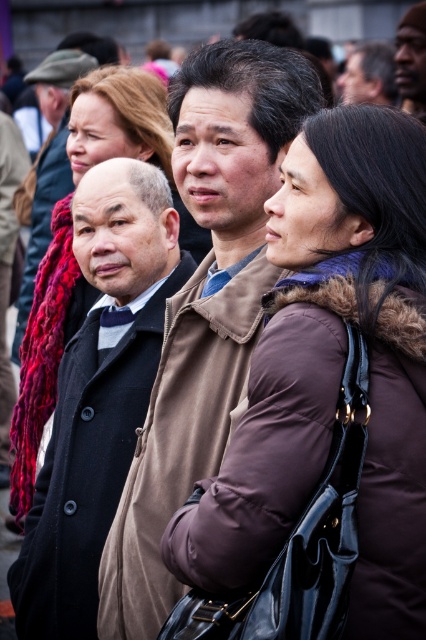
Does dark brown wool coat at center appear over knitted wool scarf at upper left?

No, dark brown wool coat at center is not above knitted wool scarf at upper left.

Describe the element at coordinates (98, 394) in the screenshot. I see `dark brown wool coat at center` at that location.

Measure the distance between dark brown wool coat at center and camera.

dark brown wool coat at center and camera are 52.27 meters apart from each other.

Where is `dark brown wool coat at center`? The image size is (426, 640). dark brown wool coat at center is located at coordinates (98, 394).

What do you see at coordinates (331, 380) in the screenshot?
I see `brown fuzzy coat at center` at bounding box center [331, 380].

Between brown fuzzy coat at center and knitted wool scarf at upper left, which one appears on the right side from the viewer's perspective?

From the viewer's perspective, brown fuzzy coat at center appears more on the right side.

Is point (354, 576) less distant than point (31, 72)?

That is True.

The height and width of the screenshot is (640, 426). I want to click on brown fuzzy coat at center, so click(331, 380).

The height and width of the screenshot is (640, 426). Describe the element at coordinates (357, 300) in the screenshot. I see `purple fuzzy scarf at center` at that location.

Which is in front, point (342, 308) or point (374, 90)?

Point (342, 308) is more forward.

Is point (400, 280) behind point (362, 45)?

No.

The width and height of the screenshot is (426, 640). Identify the location of purple fuzzy scarf at center. (357, 300).